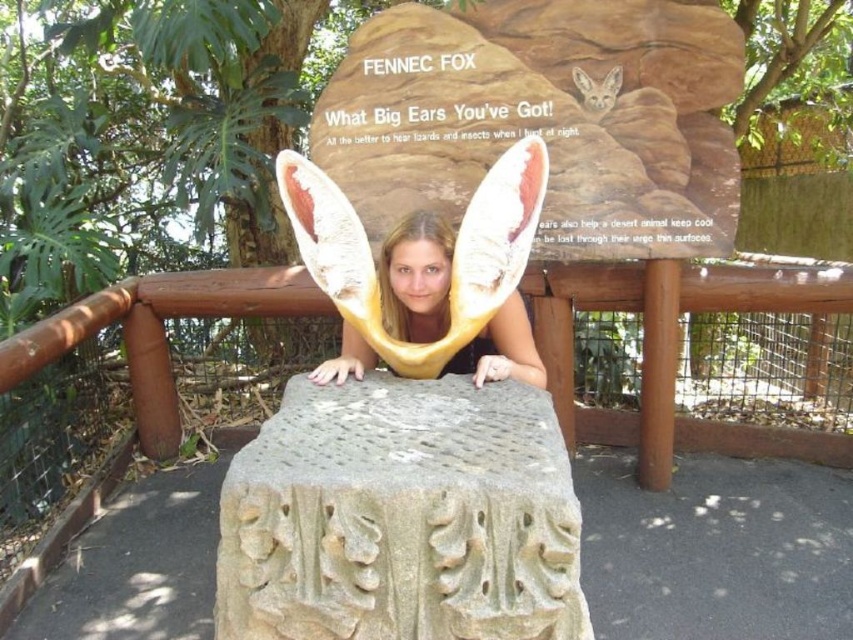
Based on the photo, you are a zoo visitor who wants to read the informational sign about the fennec fox. You notice the brown wooden rail at center and the matte yellow ears at center. Which object is taller and might block your view of the sign?

The brown wooden rail at center is much taller than the matte yellow ears at center, so it might block your view of the sign.

You are a zoo visitor standing in front of the Fennec Fox exhibit. You notice the brown wooden rail at center and the matte yellow ears at center. Which object is closer to your right side?

The brown wooden rail at center is positioned on the right side of matte yellow ears at center, so it is closer to your right side.